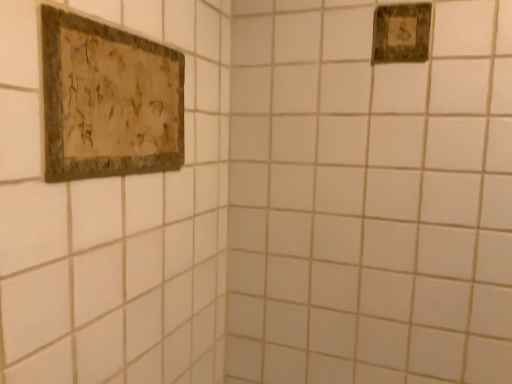
Question: From the image's perspective, is rustic wood picture frame at upper left, which is the 1th picture frame in bottom-to-top order, under rustic wood sign at upper right, which is the 2th picture frame from front to back?

Choices:
 (A) yes
 (B) no

Answer: (A)

Question: Is rustic wood picture frame at upper left, which is the 1th picture frame in bottom-to-top order, facing away from rustic wood sign at upper right, positioned as the 1th picture frame in top-to-bottom order?

Choices:
 (A) no
 (B) yes

Answer: (A)

Question: From a real-world perspective, is rustic wood picture frame at upper left, the 1th picture frame from the front, located beneath rustic wood sign at upper right, positioned as the 1th picture frame in top-to-bottom order?

Choices:
 (A) yes
 (B) no

Answer: (A)

Question: Does rustic wood picture frame at upper left, the 1th picture frame from the front, have a lesser width compared to rustic wood sign at upper right, which is counted as the first picture frame, starting from the back?

Choices:
 (A) no
 (B) yes

Answer: (A)

Question: Is rustic wood picture frame at upper left, the 2th picture frame in the back-to-front sequence, taller than rustic wood sign at upper right, placed as the 2th picture frame when sorted from left to right?

Choices:
 (A) yes
 (B) no

Answer: (A)

Question: Considering the relative positions of rustic wood picture frame at upper left, which is the second picture frame from top to bottom, and rustic wood sign at upper right, acting as the 1th picture frame starting from the right, in the image provided, is rustic wood picture frame at upper left, which is the second picture frame from top to bottom, to the left of rustic wood sign at upper right, acting as the 1th picture frame starting from the right, from the viewer's perspective?

Choices:
 (A) no
 (B) yes

Answer: (B)

Question: Is rustic wood sign at upper right, the 2th picture frame when ordered from bottom to top, far from rustic wood picture frame at upper left, acting as the second picture frame starting from the right?

Choices:
 (A) yes
 (B) no

Answer: (B)

Question: Is rustic wood sign at upper right, acting as the 1th picture frame starting from the right, positioned with its back to rustic wood picture frame at upper left, acting as the second picture frame starting from the right?

Choices:
 (A) no
 (B) yes

Answer: (A)

Question: Considering the relative sizes of rustic wood sign at upper right, positioned as the 1th picture frame in top-to-bottom order, and rustic wood picture frame at upper left, which is the second picture frame from top to bottom, in the image provided, is rustic wood sign at upper right, positioned as the 1th picture frame in top-to-bottom order, bigger than rustic wood picture frame at upper left, which is the second picture frame from top to bottom,?

Choices:
 (A) yes
 (B) no

Answer: (B)

Question: Can you confirm if rustic wood sign at upper right, which is counted as the first picture frame, starting from the back, is thinner than rustic wood picture frame at upper left, the 2th picture frame in the back-to-front sequence?

Choices:
 (A) no
 (B) yes

Answer: (B)

Question: Is rustic wood sign at upper right, which is the 2th picture frame from front to back, outside rustic wood picture frame at upper left, the 1th picture frame from the front?

Choices:
 (A) yes
 (B) no

Answer: (A)

Question: Is rustic wood sign at upper right, the 2th picture frame when ordered from bottom to top, closer to camera compared to rustic wood picture frame at upper left, the 1th picture frame from the left?

Choices:
 (A) yes
 (B) no

Answer: (B)

Question: Based on their sizes in the image, would you say rustic wood sign at upper right, which is counted as the first picture frame, starting from the back, is bigger or smaller than rustic wood picture frame at upper left, which is the 1th picture frame in bottom-to-top order?

Choices:
 (A) big
 (B) small

Answer: (B)